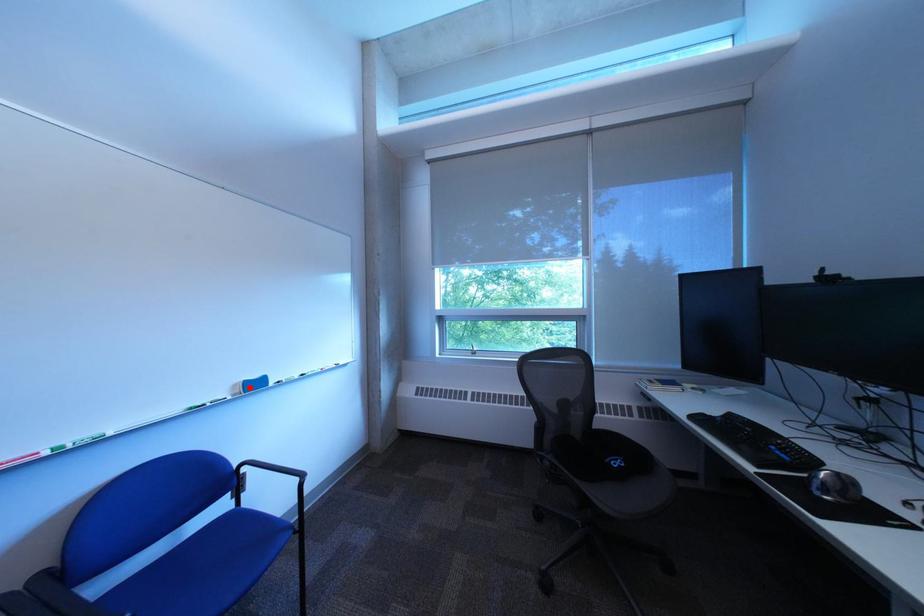
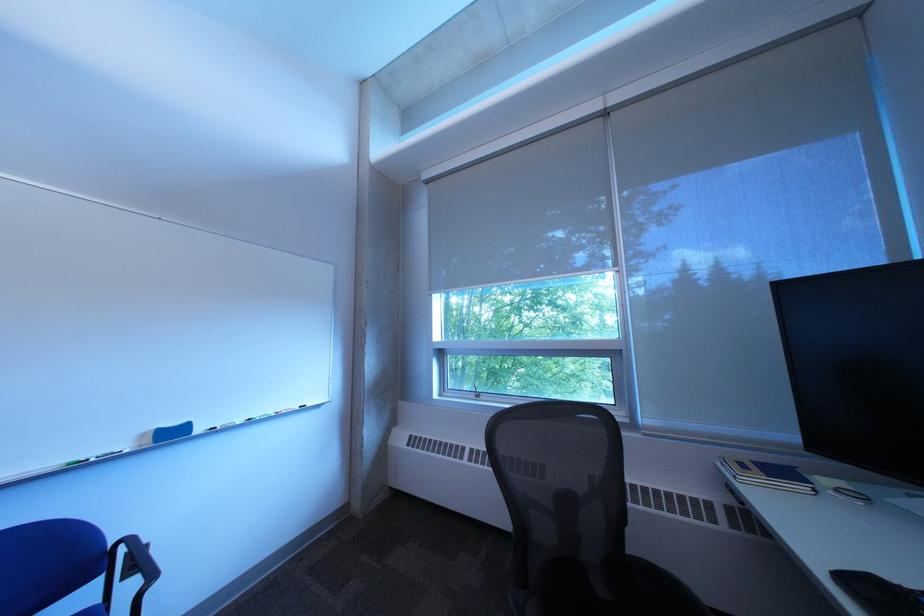
Find the pixel in the second image that matches the highlighted location in the first image.

(159, 437)